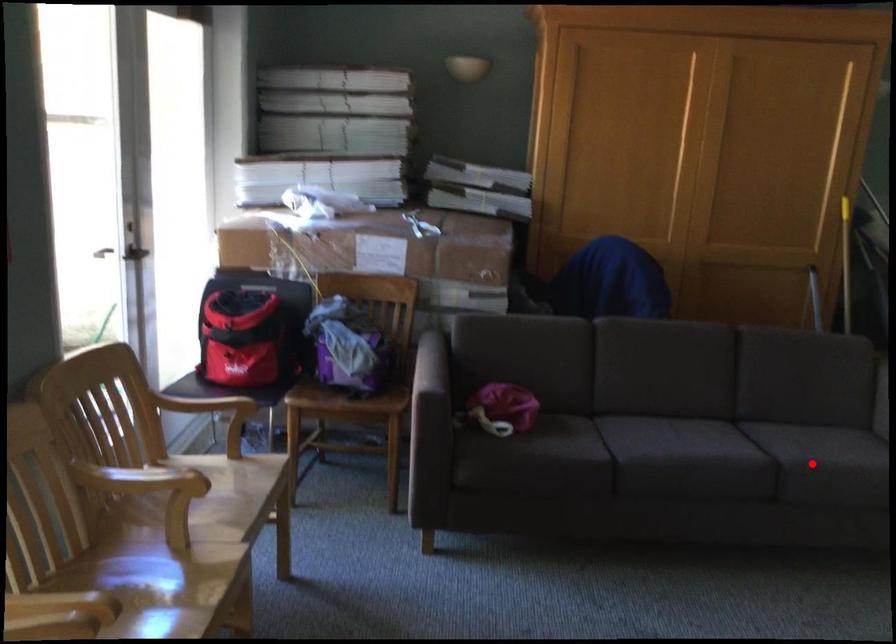
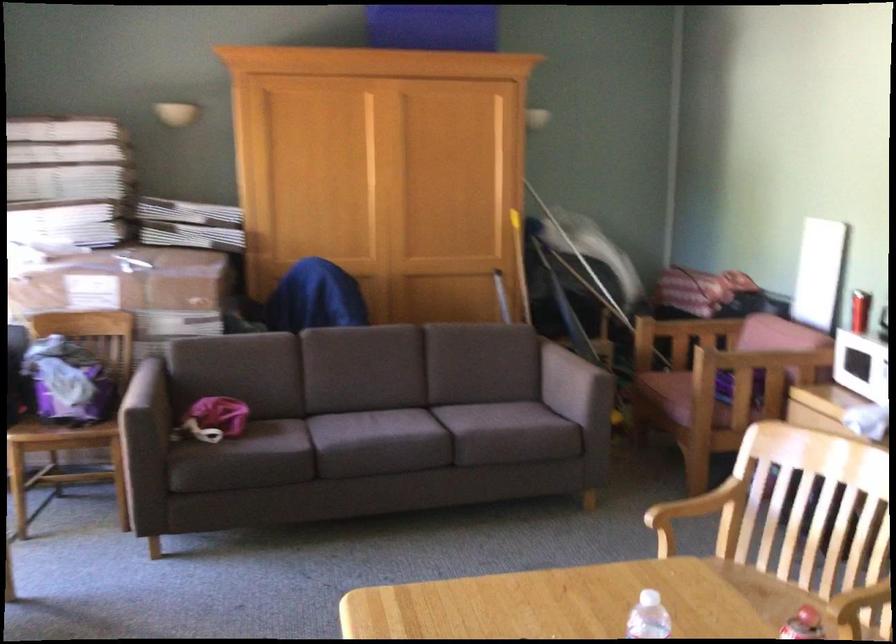
Question: I am providing you with two images of the same scene from different viewpoints. In image1, a red point is highlighted. Considering the same 3D point in image2, which of the following is correct?

Choices:
 (A) It is closer
 (B) It is farther

Answer: (B)